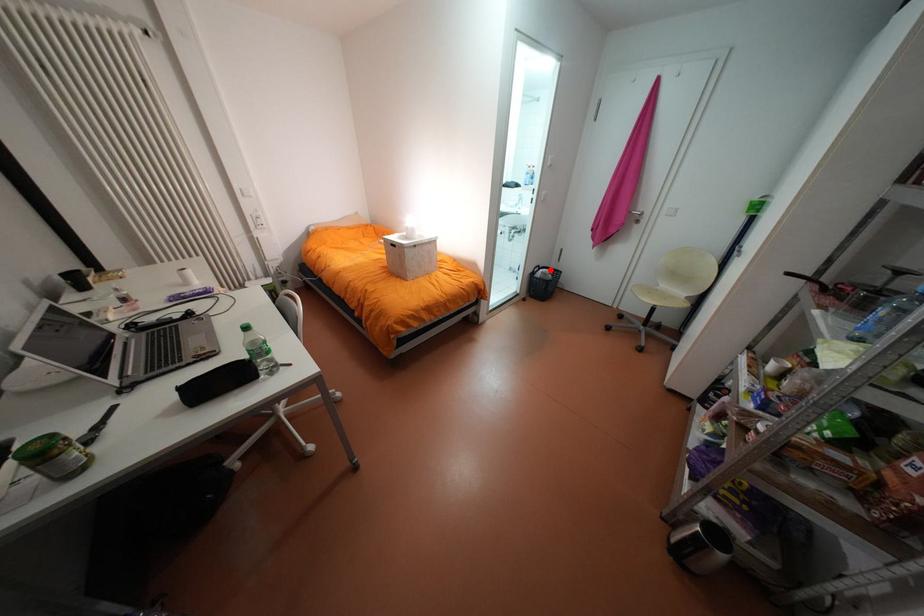
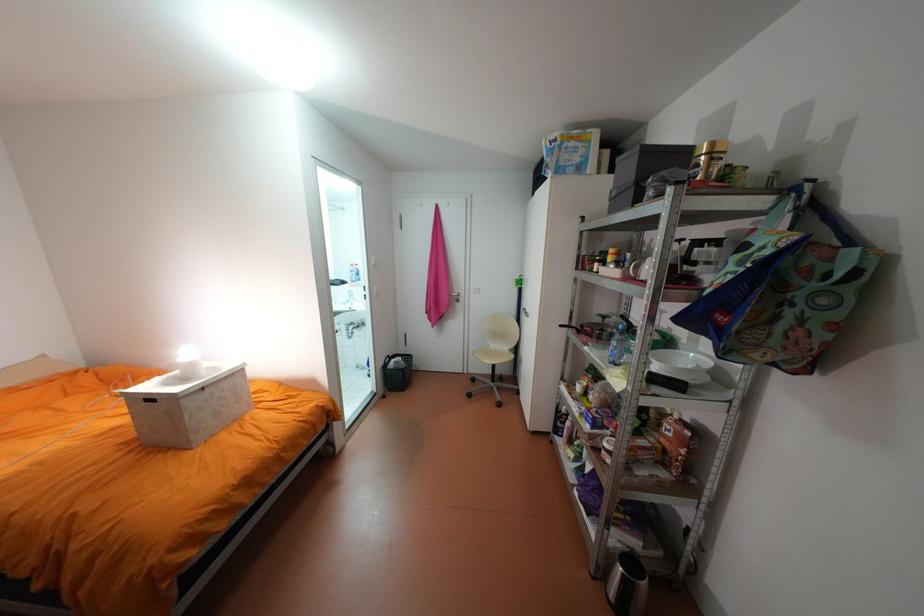
Find the pixel in the second image that matches the highlighted location in the first image.

(402, 360)